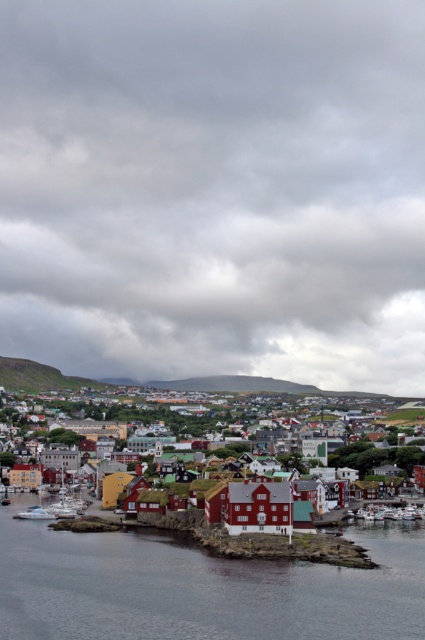
Which is in front, point (384, 604) or point (357, 456)?

Point (384, 604)

Does smooth water at lower center appear over reddish-brown wooden houses at center?

Indeed, smooth water at lower center is positioned over reddish-brown wooden houses at center.

Image resolution: width=425 pixels, height=640 pixels. Find the location of `smooth water at lower center`. smooth water at lower center is located at coordinates (201, 588).

Who is shorter, smooth water at lower center or green grassy hillside at upper left?

smooth water at lower center

Is point (201, 560) in front of point (96, 381)?

Yes, it is.

Is point (90, 620) farther from camera compared to point (3, 374)?

That is False.

Where is `smooth water at lower center`? Image resolution: width=425 pixels, height=640 pixels. smooth water at lower center is located at coordinates click(x=201, y=588).

Between green grassy hillside at upper left and reddish-brown wooden houses at center, which one has more height?

reddish-brown wooden houses at center is taller.

Does point (33, 388) come farther from viewer compared to point (404, 449)?

Yes.

At what (x,y) coordinates should I click in order to perform the action: click on green grassy hillside at upper left. Please return your answer as a coordinate pair (x, y). Looking at the image, I should click on (39, 376).